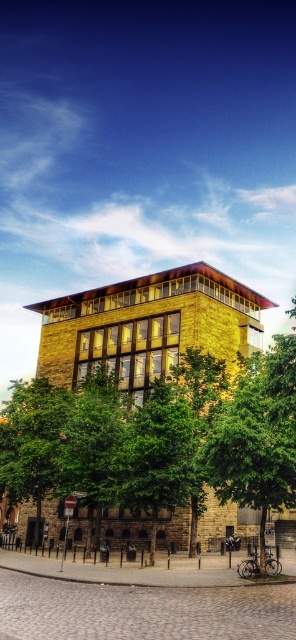
Question: Which point is closer to the camera?

Choices:
 (A) (171, 467)
 (B) (2, 464)

Answer: (A)

Question: Does green leafy tree at center have a larger size compared to green leafy tree at lower left?

Choices:
 (A) no
 (B) yes

Answer: (A)

Question: Does green leafy tree at center have a lesser width compared to green leafy tree at lower left?

Choices:
 (A) yes
 (B) no

Answer: (A)

Question: Does green leafy tree at center appear under green leafy tree at lower left?

Choices:
 (A) yes
 (B) no

Answer: (B)

Question: Among these objects, which one is farthest from the camera?

Choices:
 (A) green leafy tree at lower left
 (B) green leafy tree at center

Answer: (A)